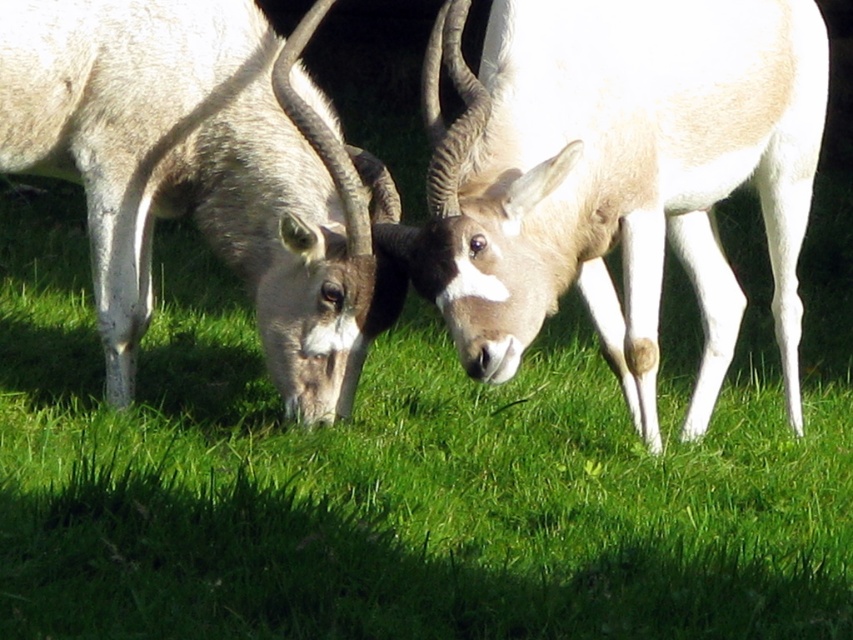
Question: Which object is closer to the camera taking this photo?

Choices:
 (A) white fur antelope at center
 (B) white woolen antelope at center
 (C) green grass at center

Answer: (C)

Question: Which point is farther from the camera taking this photo?

Choices:
 (A) (x=505, y=253)
 (B) (x=358, y=232)
 (C) (x=546, y=572)

Answer: (B)

Question: From the image, what is the correct spatial relationship of green grass at center in relation to white fur antelope at center?

Choices:
 (A) below
 (B) above

Answer: (A)

Question: Where is white fur antelope at center located in relation to white woolen antelope at center in the image?

Choices:
 (A) left
 (B) right

Answer: (B)

Question: Is green grass at center in front of white woolen antelope at center?

Choices:
 (A) yes
 (B) no

Answer: (A)

Question: Estimate the real-world distances between objects in this image. Which object is farther from the white fur antelope at center?

Choices:
 (A) green grass at center
 (B) white woolen antelope at center

Answer: (A)